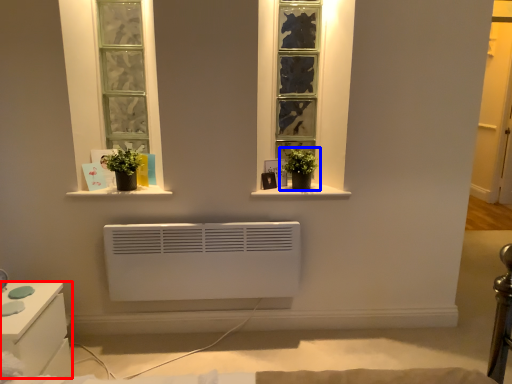
Question: Which object appears closest to the camera in this image, furniture (highlighted by a red box) or houseplant (highlighted by a blue box)?

Choices:
 (A) furniture
 (B) houseplant

Answer: (A)